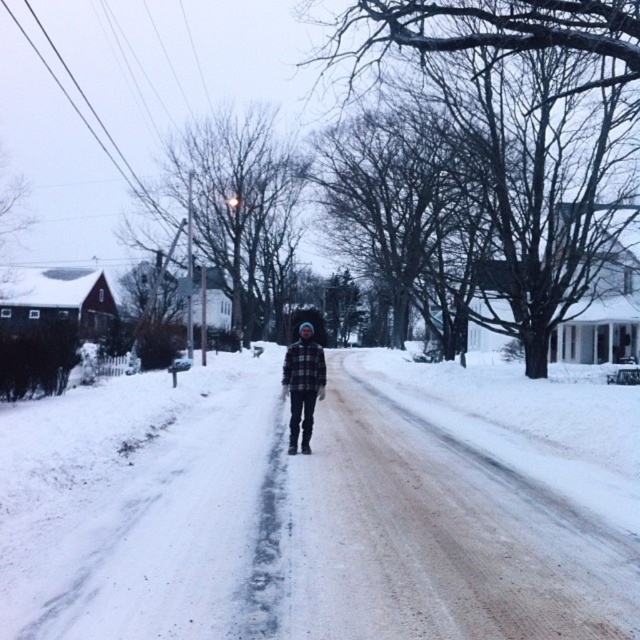
Can you confirm if white fluffy snow at center is bigger than plaid flannel shirt at center?

Yes.

Who is positioned more to the right, white fluffy snow at center or plaid flannel shirt at center?

Positioned to the right is plaid flannel shirt at center.

Measure the distance between white fluffy snow at center and camera.

They are 4.60 meters apart.

The height and width of the screenshot is (640, 640). Find the location of `white fluffy snow at center`. white fluffy snow at center is located at coordinates (282, 524).